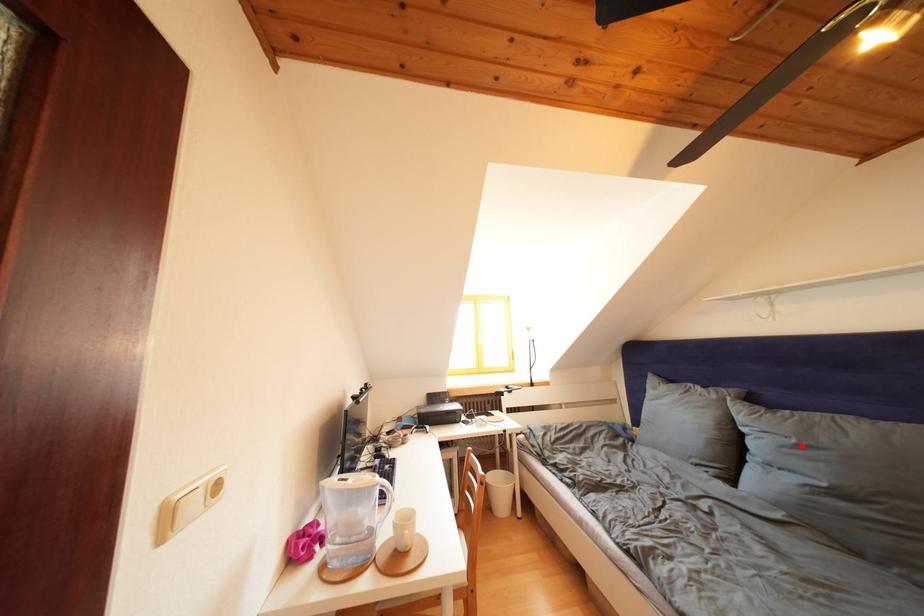
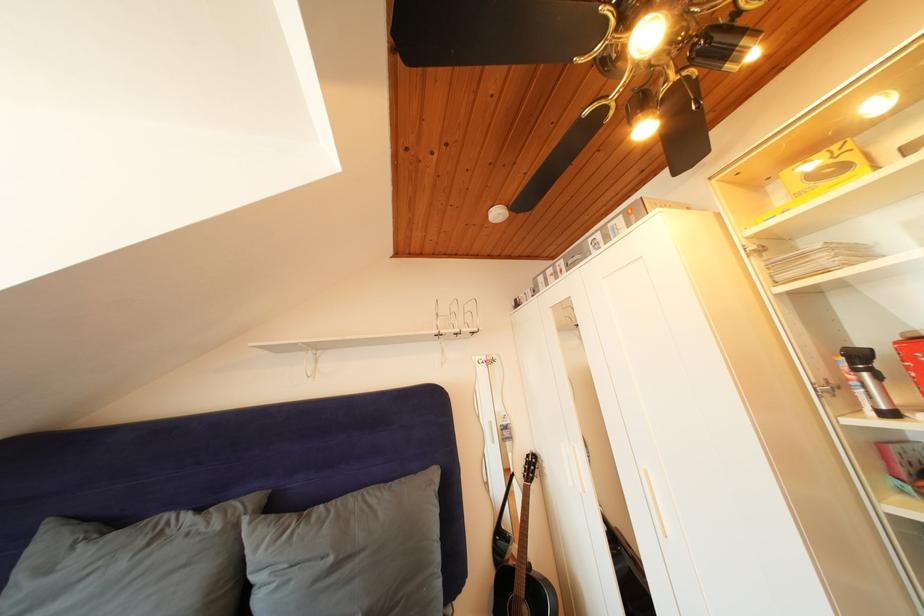
Where in the second image is the point corresponding to the highlighted location from the first image?

(338, 565)